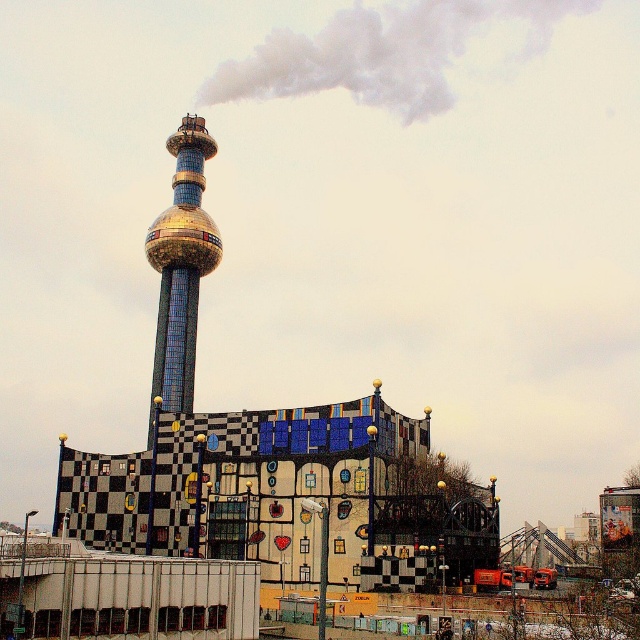
From the picture: You are an architect analyzing the structure of the gold mosaic tower at center and the white smoke at upper center. Based on their positions, which object is located to the right of the other?

The white smoke at upper center is positioned on the right side of gold mosaic tower at center.

You are an architect analyzing the image of the tower and the building. Based on the scene, which object is positioned higher in the image, the white smoke at upper center or the gold mosaic tower at center?

The white smoke at upper center is located above the gold mosaic tower at center, so it is positioned higher in the image.

You are an architect analyzing the image of a modern building complex. You notice the gold mosaic tower at center and the white smoke at upper center. Based on their positions, which object is closer to the viewer?

The white smoke at upper center is closer to the viewer because it appears in front of the gold mosaic tower at center.